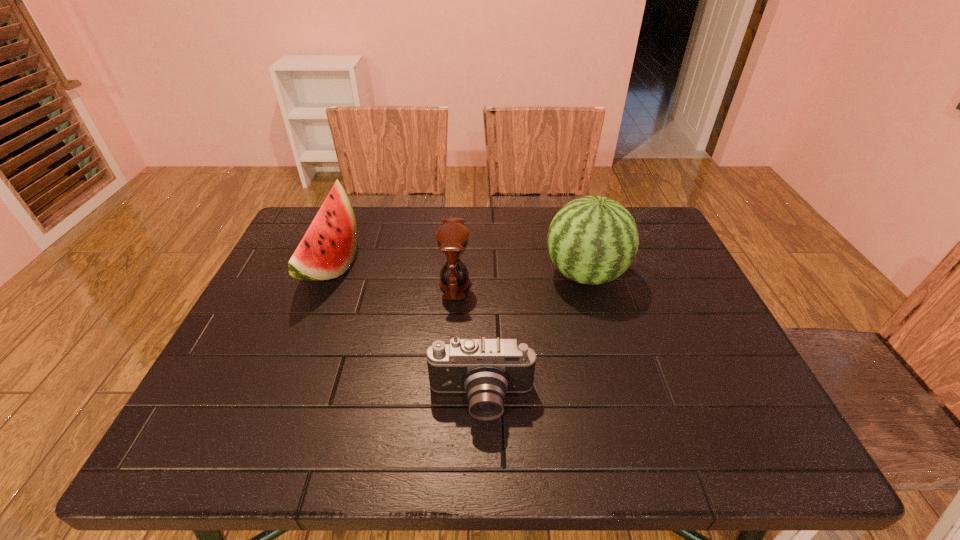
Where is `unoccupied area between the nearest object and the taller watermelon`? unoccupied area between the nearest object and the taller watermelon is located at coordinates (534, 338).

Identify the location of vacant area that lies between the left watermelon and the shortest object. Image resolution: width=960 pixels, height=540 pixels. (406, 333).

Identify the location of free space between the nearest object and the tallest object. (534, 338).

The width and height of the screenshot is (960, 540). Find the location of `blank region between the right watermelon and the nearest object`. blank region between the right watermelon and the nearest object is located at coordinates (534, 338).

This screenshot has height=540, width=960. I want to click on vacant space that is in between the hourglass and the right watermelon, so click(x=520, y=279).

Identify the location of vacant space in between the shortest object and the taller watermelon. The width and height of the screenshot is (960, 540). (534, 338).

This screenshot has height=540, width=960. Find the location of `object identified as the second closest to the shortest object`. object identified as the second closest to the shortest object is located at coordinates (592, 240).

The width and height of the screenshot is (960, 540). I want to click on object that is the closest to the right watermelon, so click(452, 238).

Identify the location of free space that satisfies the following two spatial constraints: 1. on the outer rind of the leftmost object; 2. on the right side of the tallest object. (327, 274).

Locate an element on the screen. This screenshot has height=540, width=960. free point that satisfies the following two spatial constraints: 1. on the outer rind of the left watermelon; 2. on the left side of the hourglass is located at coordinates (324, 284).